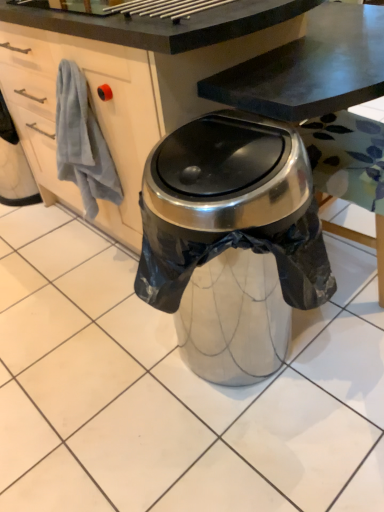
Question: Considering their positions, is metallic trash can at center located in front of or behind white matte cabinet at left?

Choices:
 (A) front
 (B) behind

Answer: (A)

Question: In terms of width, does metallic trash can at center look wider or thinner when compared to white matte cabinet at left?

Choices:
 (A) wide
 (B) thin

Answer: (A)

Question: From a real-world perspective, is metallic trash can at center physically located above or below white matte cabinet at left?

Choices:
 (A) below
 (B) above

Answer: (A)

Question: From a real-world perspective, is white matte cabinet at left physically located above or below metallic trash can at center?

Choices:
 (A) above
 (B) below

Answer: (A)

Question: Does point (130, 71) appear closer or farther from the camera than point (39, 271)?

Choices:
 (A) closer
 (B) farther

Answer: (A)

Question: Is white matte cabinet at left to the left or to the right of metallic trash can at center in the image?

Choices:
 (A) left
 (B) right

Answer: (A)

Question: Is white matte cabinet at left bigger or smaller than metallic trash can at center?

Choices:
 (A) small
 (B) big

Answer: (A)